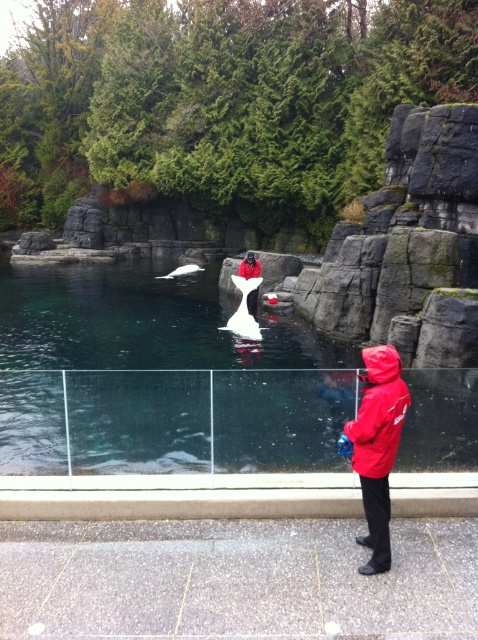
Question: Which point is farther from the camera taking this photo?

Choices:
 (A) (408, 401)
 (B) (253, 300)
 (C) (192, 312)

Answer: (C)

Question: Which is farther from the clear glass water at center?

Choices:
 (A) red matte jacket at lower right
 (B) red matte jacket at center
 (C) white glossy swan at center

Answer: (A)

Question: Which object appears closest to the camera in this image?

Choices:
 (A) red matte jacket at lower right
 (B) clear glass water at center
 (C) white glossy swan at center
 (D) red matte jacket at center

Answer: (A)

Question: Does red matte jacket at lower right appear over red matte jacket at center?

Choices:
 (A) no
 (B) yes

Answer: (A)

Question: Can you confirm if clear glass water at center is positioned below red matte jacket at center?

Choices:
 (A) yes
 (B) no

Answer: (A)

Question: Does white glossy swan at center appear on the left side of red matte jacket at center?

Choices:
 (A) no
 (B) yes

Answer: (B)